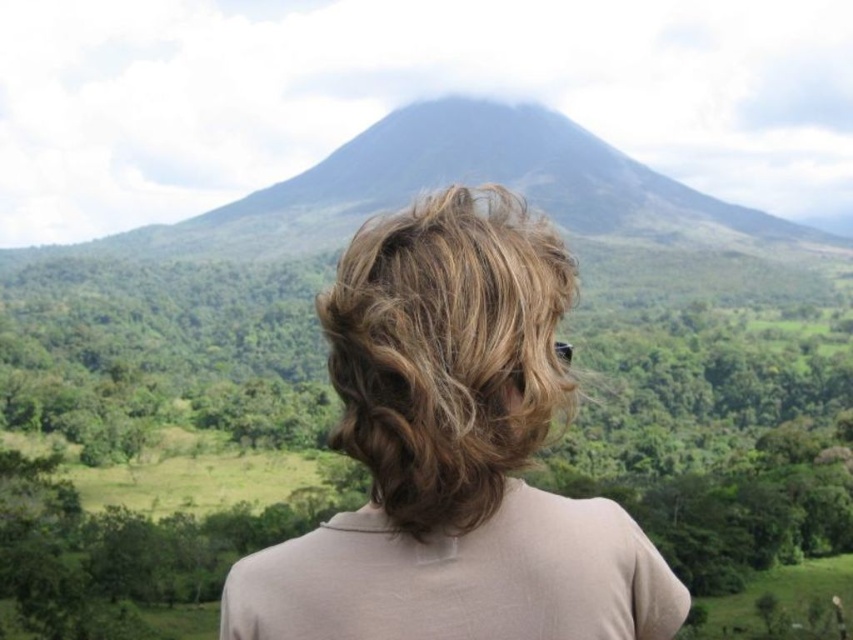
Question: Which point is farther to the camera?

Choices:
 (A) [x=461, y=502]
 (B) [x=465, y=292]

Answer: (B)

Question: Does blonde hair at center appear on the left side of blonde curly hair at center?

Choices:
 (A) no
 (B) yes

Answer: (A)

Question: Is blonde hair at center bigger than blonde curly hair at center?

Choices:
 (A) no
 (B) yes

Answer: (B)

Question: Which point is closer to the camera taking this photo?

Choices:
 (A) [x=260, y=556]
 (B) [x=393, y=218]

Answer: (A)

Question: Which point is farther to the camera?

Choices:
 (A) (543, 513)
 (B) (397, 218)

Answer: (B)

Question: Is blonde hair at center below blonde curly hair at center?

Choices:
 (A) yes
 (B) no

Answer: (A)